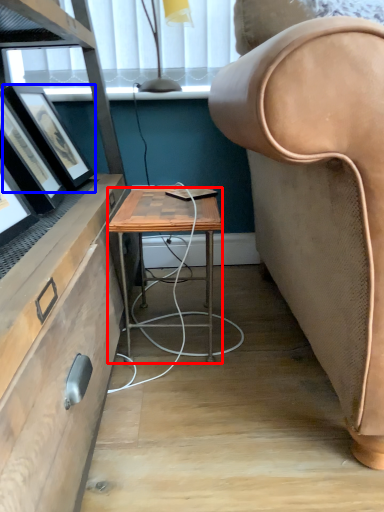
Question: Among these objects, which one is nearest to the camera, desk (highlighted by a red box) or picture frame (highlighted by a blue box)?

Choices:
 (A) desk
 (B) picture frame

Answer: (A)